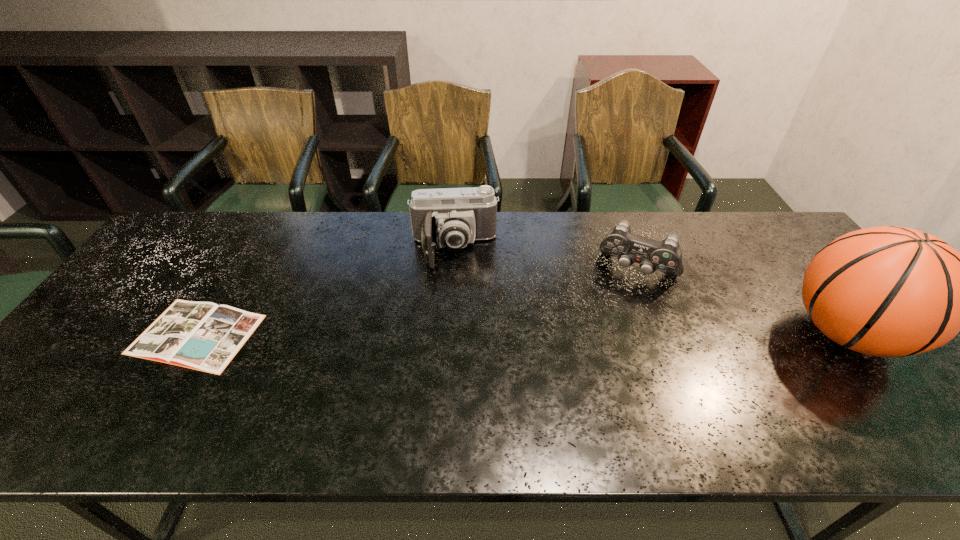
You are a GUI agent. You are given a task and a screenshot of the screen. Output one action in this format:
    pyautogui.click(x=<x>, y=<y>)
    Task: Click on the shortest object
    This screenshot has height=540, width=960.
    Given the screenshot: What is the action you would take?
    pyautogui.click(x=204, y=336)

Locate an element on the screen. book is located at coordinates [204, 336].

Locate an element on the screen. basketball is located at coordinates (887, 291).

The width and height of the screenshot is (960, 540). Identify the location of the rightmost object. (887, 291).

This screenshot has width=960, height=540. I want to click on camera, so click(452, 217).

Find the location of a particular element. The image size is (960, 540). control is located at coordinates (666, 256).

Locate an element on the screen. The height and width of the screenshot is (540, 960). the second shortest object is located at coordinates (666, 256).

Where is `vacant area situated on the right of the shortest object`? This screenshot has height=540, width=960. vacant area situated on the right of the shortest object is located at coordinates (359, 334).

Locate an element on the screen. vacant region located on the left of the basketball is located at coordinates (736, 333).

Identify the location of free space located at the front of the camera with an open lens cover. This screenshot has width=960, height=540. (457, 309).